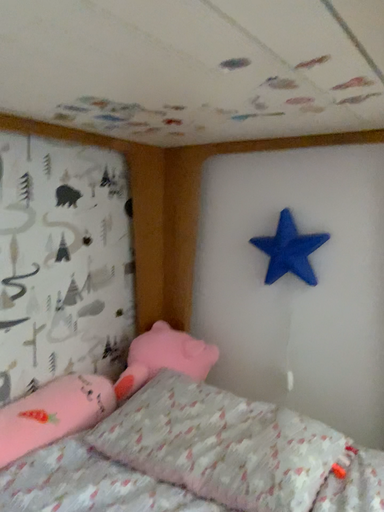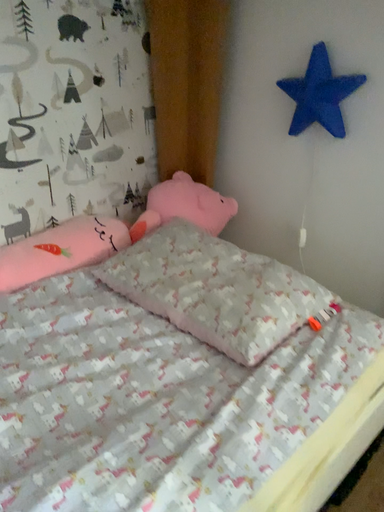
Question: How did the camera likely rotate when shooting the video?

Choices:
 (A) rotated right
 (B) rotated left

Answer: (B)